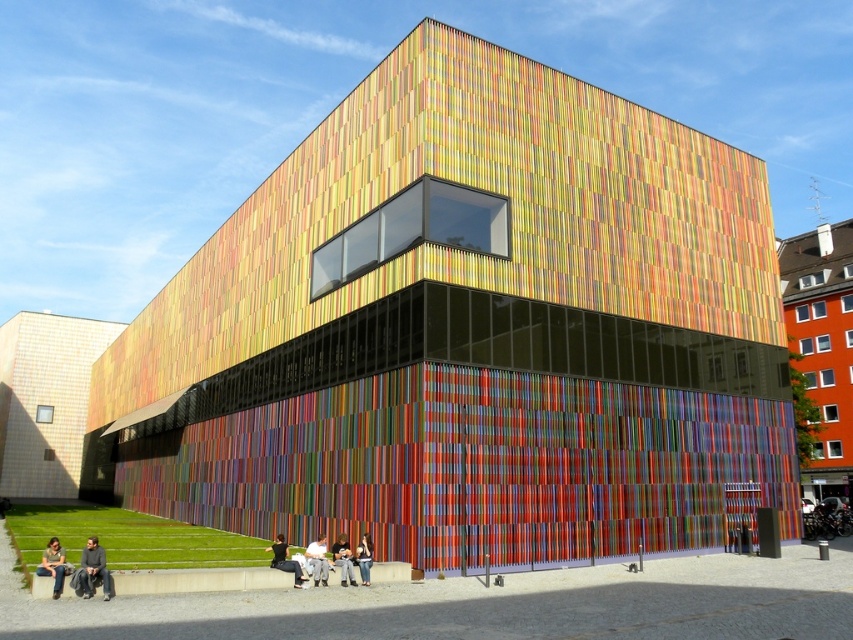
You are a visitor standing in front of the orange matte building at right and the denim pants at lower center. Which object is taller?

The orange matte building at right is taller than the denim pants at lower center.

You are a photographer trying to capture the orange matte building at right and the denim pants at lower center in a single frame. Given their sizes, which object should you focus on to ensure both are clearly visible in the photo?

Since the orange matte building at right is larger than the denim pants at lower center, you should focus on the orange matte building at right to ensure both are clearly visible in the photo.

You are standing in front of the modern building and want to take a photo of the orange matte building at right without including the denim pants at lower center in the frame. Which direction should you move to achieve this?

The orange matte building at right is positioned over denim pants at lower center. To avoid including the denim pants at lower center in the photo, move to the left side of the denim pants at lower center so the building is no longer overlapping them in the frame.